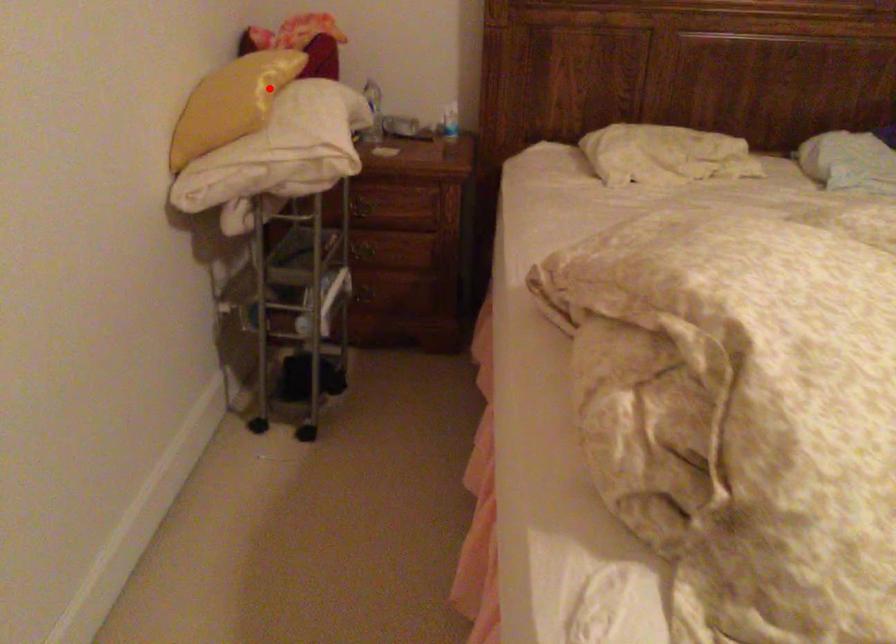
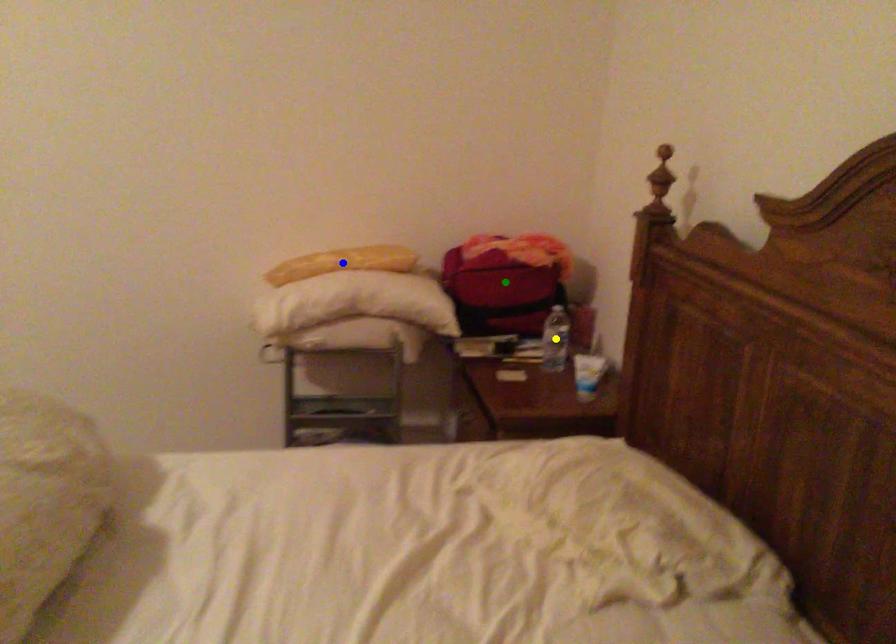
Question: I am providing you with two images of the same scene from different viewpoints. A red point is marked on the first image. You are given multiple points on the second image. Which point in image 2 is actually the same real-world point as the red point in image 1?

Choices:
 (A) green point
 (B) blue point
 (C) yellow point

Answer: (B)